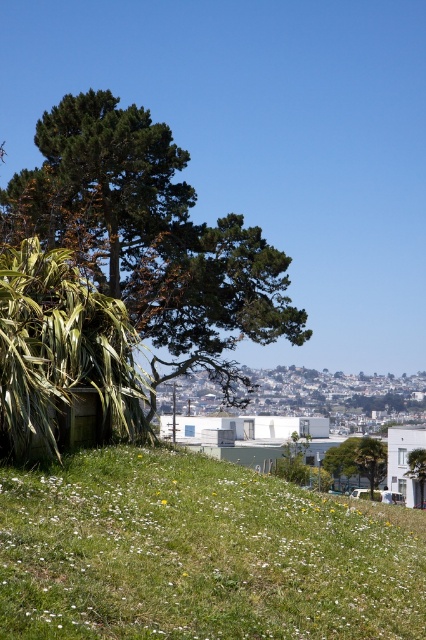
Can you confirm if green grassy hillside at lower left is positioned above green leafy tree at center?

Indeed, green grassy hillside at lower left is positioned over green leafy tree at center.

Is point (135, 502) farther from camera compared to point (374, 461)?

No.

Where is `green grassy hillside at lower left`? green grassy hillside at lower left is located at coordinates (198, 554).

Measure the distance between point (193, 499) and camera.

The distance of point (193, 499) from camera is 16.54 meters.

Can you confirm if green grassy hillside at lower left is positioned to the left of green leafy tree at upper left?

Incorrect, green grassy hillside at lower left is not on the left side of green leafy tree at upper left.

This screenshot has height=640, width=426. Identify the location of green grassy hillside at lower left. (198, 554).

Identify the location of green grassy hillside at lower left. The width and height of the screenshot is (426, 640). (198, 554).

Can you confirm if green leafy tree at upper left is thinner than green leafy tree at center?

In fact, green leafy tree at upper left might be wider than green leafy tree at center.

In the scene shown: Is green leafy tree at upper left to the right of green leafy tree at center from the viewer's perspective?

No, green leafy tree at upper left is not to the right of green leafy tree at center.

Is point (158, 256) farther from viewer compared to point (371, 477)?

That is False.

Locate an element on the screen. Image resolution: width=426 pixels, height=640 pixels. green leafy tree at upper left is located at coordinates (149, 237).